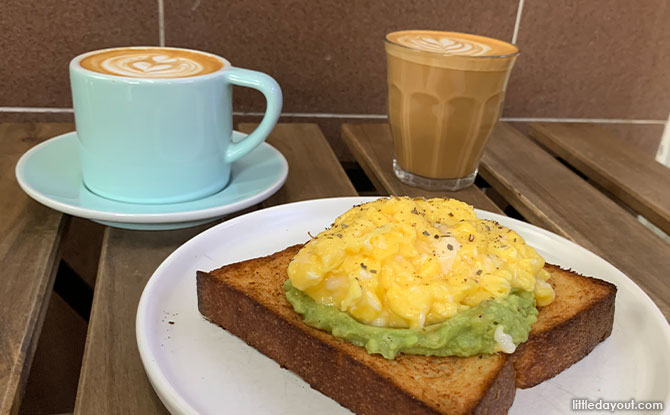
This screenshot has height=415, width=670. I want to click on brown slates of a wooden table, so click(x=29, y=264), click(x=312, y=169), click(x=522, y=190), click(x=634, y=163).